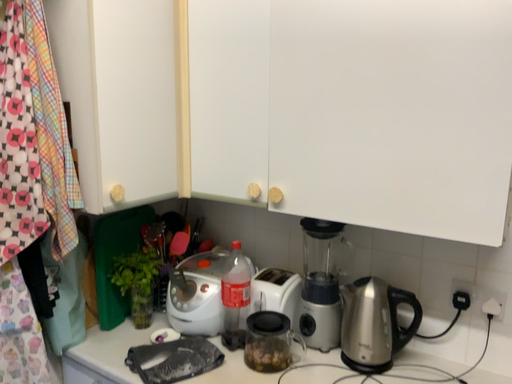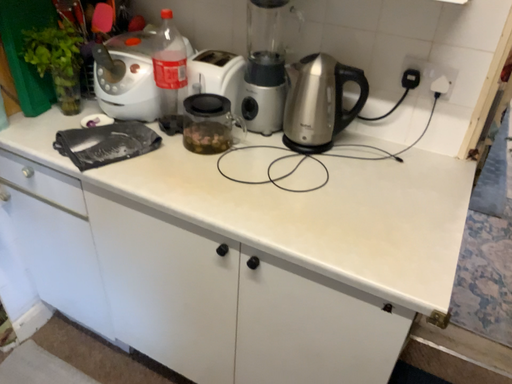
Question: Which way did the camera rotate in the video?

Choices:
 (A) rotated downward
 (B) rotated upward

Answer: (A)